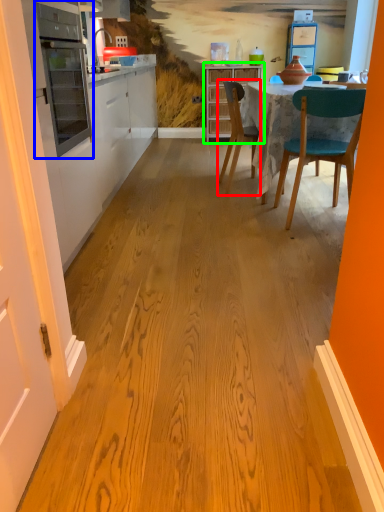
Question: Which is farther away from chair (highlighted by a red box)? appliance (highlighted by a blue box) or cabinetry (highlighted by a green box)?

Choices:
 (A) appliance
 (B) cabinetry

Answer: (B)